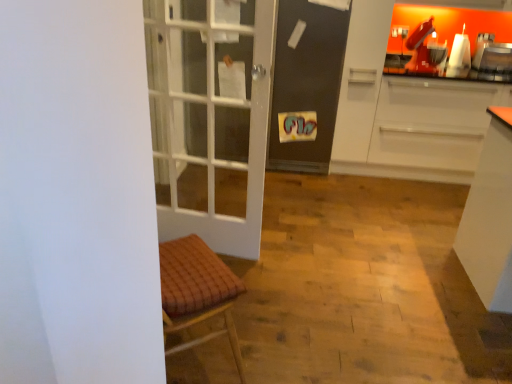
Question: Is matte black screen door at center at the back of metallic silver toaster at upper right?

Choices:
 (A) no
 (B) yes

Answer: (A)

Question: Is metallic silver toaster at upper right behind matte black screen door at center?

Choices:
 (A) yes
 (B) no

Answer: (A)

Question: Considering the relative sizes of metallic silver toaster at upper right and matte black screen door at center in the image provided, is metallic silver toaster at upper right wider than matte black screen door at center?

Choices:
 (A) no
 (B) yes

Answer: (A)

Question: Can you confirm if metallic silver toaster at upper right is taller than matte black screen door at center?

Choices:
 (A) yes
 (B) no

Answer: (B)

Question: Can you confirm if metallic silver toaster at upper right is thinner than matte black screen door at center?

Choices:
 (A) yes
 (B) no

Answer: (A)

Question: Could you tell me if metallic silver toaster at upper right is facing matte black screen door at center?

Choices:
 (A) yes
 (B) no

Answer: (B)

Question: From a real-world perspective, is white matte cabinet at right positioned under matte black screen door at center based on gravity?

Choices:
 (A) yes
 (B) no

Answer: (B)

Question: Is white matte cabinet at right looking in the opposite direction of matte black screen door at center?

Choices:
 (A) yes
 (B) no

Answer: (A)

Question: Considering the relative positions of white matte cabinet at right and matte black screen door at center in the image provided, is white matte cabinet at right behind matte black screen door at center?

Choices:
 (A) yes
 (B) no

Answer: (B)

Question: From a real-world perspective, is white matte cabinet at right located higher than matte black screen door at center?

Choices:
 (A) yes
 (B) no

Answer: (A)

Question: Does white matte cabinet at right appear on the right side of matte black screen door at center?

Choices:
 (A) no
 (B) yes

Answer: (B)

Question: Is matte black screen door at center surrounded by white matte cabinet at right?

Choices:
 (A) yes
 (B) no

Answer: (A)

Question: From the image's perspective, does white matte cabinet at right appear lower than metallic silver toaster at upper right?

Choices:
 (A) no
 (B) yes

Answer: (B)